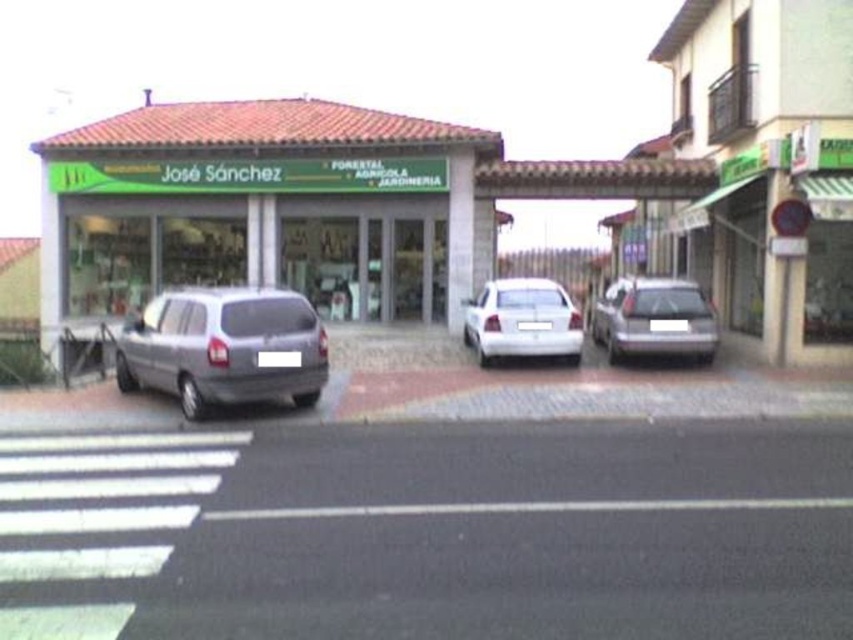
Between satin silver van at center and white glossy sedan at center, which one has more height?

white glossy sedan at center is taller.

Does satin silver van at center have a greater width compared to white glossy sedan at center?

Incorrect, satin silver van at center's width does not surpass white glossy sedan at center's.

Is point (199, 378) less distant than point (466, 312)?

Yes, it is.

This screenshot has height=640, width=853. What are the coordinates of `satin silver van at center` in the screenshot? It's located at (224, 348).

Who is taller, black asphalt road at lower center or satin silver van at center?

Standing taller between the two is satin silver van at center.

Can you confirm if black asphalt road at lower center is shorter than satin silver van at center?

Correct, black asphalt road at lower center is not as tall as satin silver van at center.

Image resolution: width=853 pixels, height=640 pixels. Describe the element at coordinates (463, 538) in the screenshot. I see `black asphalt road at lower center` at that location.

In order to click on black asphalt road at lower center in this screenshot , I will do `click(463, 538)`.

From the picture: Which is below, green matte storefront at center or white glossy sedan at center?

white glossy sedan at center

Between green matte storefront at center and white glossy sedan at center, which one is positioned higher?

green matte storefront at center is above.

Measure the distance between point (381, 296) and camera.

They are 21.13 meters apart.

Locate an element on the screen. This screenshot has height=640, width=853. green matte storefront at center is located at coordinates tap(260, 205).